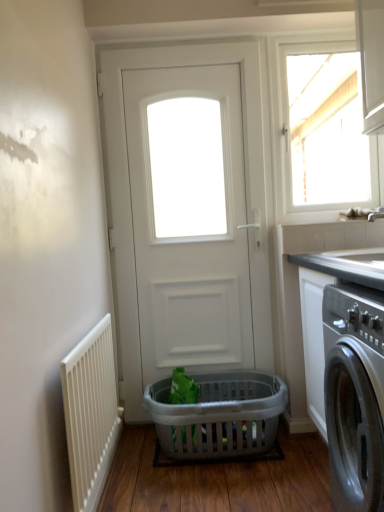
Question: Does smooth gray countertop at right come behind white matte door at center?

Choices:
 (A) no
 (B) yes

Answer: (A)

Question: Does smooth gray countertop at right have a lesser height compared to white matte door at center?

Choices:
 (A) yes
 (B) no

Answer: (A)

Question: Considering the relative sizes of smooth gray countertop at right and white matte door at center in the image provided, is smooth gray countertop at right wider than white matte door at center?

Choices:
 (A) no
 (B) yes

Answer: (B)

Question: Is smooth gray countertop at right aimed at white matte door at center?

Choices:
 (A) yes
 (B) no

Answer: (B)

Question: Is smooth gray countertop at right turned away from white matte door at center?

Choices:
 (A) no
 (B) yes

Answer: (A)

Question: Is smooth gray countertop at right next to white matte door at center and touching it?

Choices:
 (A) no
 (B) yes

Answer: (A)

Question: From a real-world perspective, is white matte door at center physically below white glossy window at upper right?

Choices:
 (A) no
 (B) yes

Answer: (B)

Question: Does white matte door at center have a larger size compared to white glossy window at upper right?

Choices:
 (A) yes
 (B) no

Answer: (A)

Question: Considering the relative sizes of white matte door at center and white glossy window at upper right in the image provided, is white matte door at center wider than white glossy window at upper right?

Choices:
 (A) yes
 (B) no

Answer: (A)

Question: Is white matte door at center positioned beyond the bounds of white glossy window at upper right?

Choices:
 (A) no
 (B) yes

Answer: (B)

Question: Is the depth of white matte door at center greater than that of white glossy window at upper right?

Choices:
 (A) no
 (B) yes

Answer: (A)

Question: Considering the relative sizes of white matte door at center and white glossy window at upper right in the image provided, is white matte door at center thinner than white glossy window at upper right?

Choices:
 (A) yes
 (B) no

Answer: (B)

Question: Does white matte door at center lie in front of white plastic radiator at lower left?

Choices:
 (A) no
 (B) yes

Answer: (A)